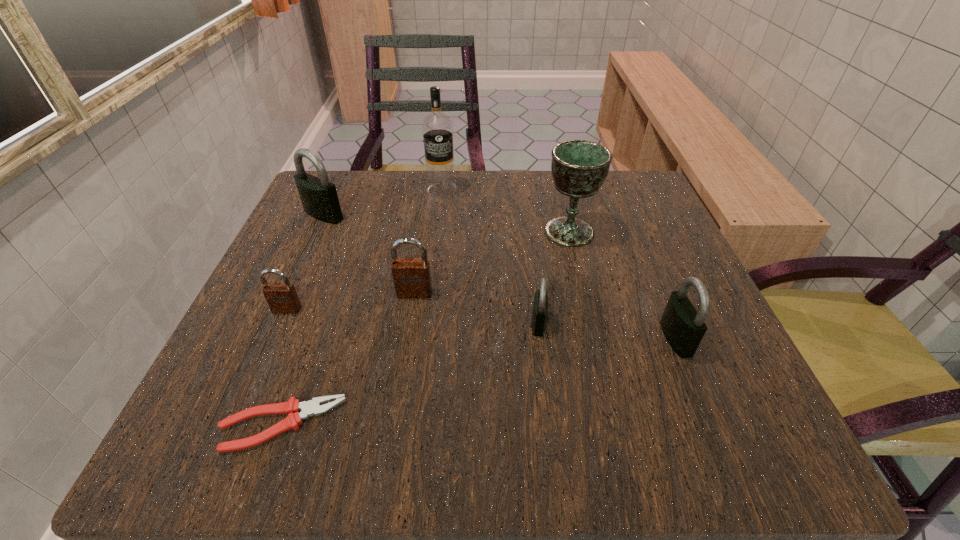
Locate an element on the screen. Image resolution: width=960 pixels, height=540 pixels. the farthest object is located at coordinates (437, 127).

Where is `vodka`? Image resolution: width=960 pixels, height=540 pixels. vodka is located at coordinates (437, 127).

The image size is (960, 540). In order to click on the seventh object from left to right in this screenshot , I will do `click(579, 167)`.

Find the location of `the biggest black padlock`. the biggest black padlock is located at coordinates (x=319, y=198).

Locate an element on the screen. the farthest padlock is located at coordinates (319, 198).

This screenshot has height=540, width=960. Find the location of `the fifth nearest object`. the fifth nearest object is located at coordinates (412, 279).

I want to click on the third padlock from right to left, so click(412, 279).

Where is `the second biggest black padlock`? the second biggest black padlock is located at coordinates (683, 326).

Where is `the rightmost padlock`? The width and height of the screenshot is (960, 540). the rightmost padlock is located at coordinates click(683, 326).

Image resolution: width=960 pixels, height=540 pixels. I want to click on the second black padlock from right to left, so click(x=540, y=304).